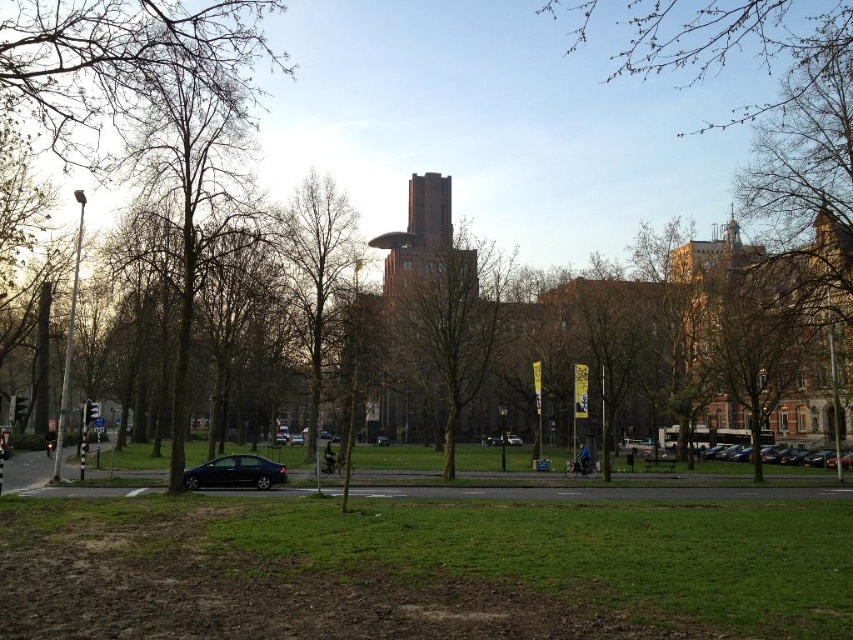
Which is below, green grass at lower center or shiny silver car at center?

shiny silver car at center

Is green grass at lower center positioned before shiny silver car at center?

Yes, it is in front of shiny silver car at center.

Image resolution: width=853 pixels, height=640 pixels. Identify the location of green grass at lower center. (421, 570).

Can you confirm if green leafy tree at center is shorter than brown brick tower at center?

No.

Which is behind, point (315, 337) or point (436, 209)?

The point (436, 209) is more distant.

Is point (299, 310) positioned after point (432, 204)?

No.

This screenshot has height=640, width=853. I want to click on green leafy tree at center, so click(x=318, y=276).

Which is above, brown brick tower at center or black matte car at center?

brown brick tower at center is above.

Is brown brick tower at center wider than black matte car at center?

Yes.

Is point (447, 209) farther from viewer compared to point (386, 438)?

No, (447, 209) is closer to viewer.

Where is `brown brick tower at center`? This screenshot has width=853, height=640. brown brick tower at center is located at coordinates (416, 228).